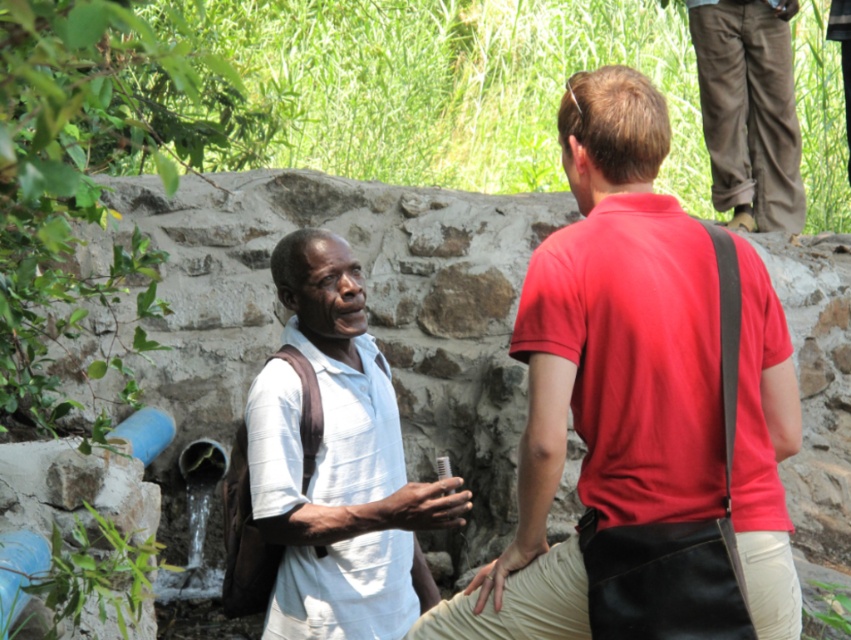
Question: Considering the real-world distances, which object is closest to the white cotton shirt at center?

Choices:
 (A) matte red shirt at center
 (B) khaki pants at upper right

Answer: (A)

Question: Does matte red shirt at center lie in front of white cotton shirt at center?

Choices:
 (A) yes
 (B) no

Answer: (A)

Question: Estimate the real-world distances between objects in this image. Which object is closer to the matte red shirt at center?

Choices:
 (A) white cotton shirt at center
 (B) khaki pants at upper right

Answer: (A)

Question: Considering the relative positions of matte red shirt at center and khaki pants at upper right in the image provided, where is matte red shirt at center located with respect to khaki pants at upper right?

Choices:
 (A) below
 (B) above

Answer: (A)

Question: Where is white cotton shirt at center located in relation to khaki pants at upper right in the image?

Choices:
 (A) right
 (B) left

Answer: (B)

Question: Among these points, which one is nearest to the camera?

Choices:
 (A) (337, 456)
 (B) (520, 598)

Answer: (B)